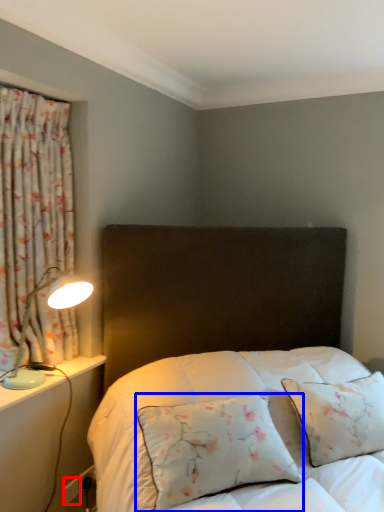
Question: Which object appears closest to the camera in this image, electric outlet (highlighted by a red box) or pillow (highlighted by a blue box)?

Choices:
 (A) electric outlet
 (B) pillow

Answer: (B)